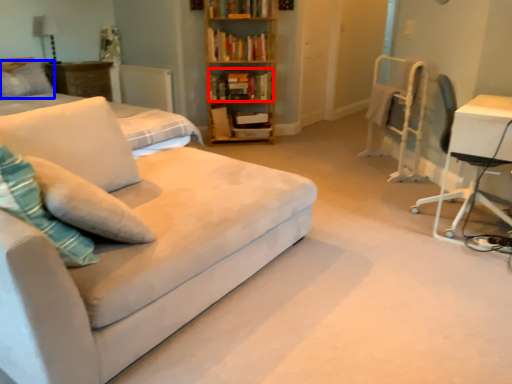
Question: Which of the following is the closest to the observer, book (highlighted by a red box) or pillow (highlighted by a blue box)?

Choices:
 (A) book
 (B) pillow

Answer: (B)